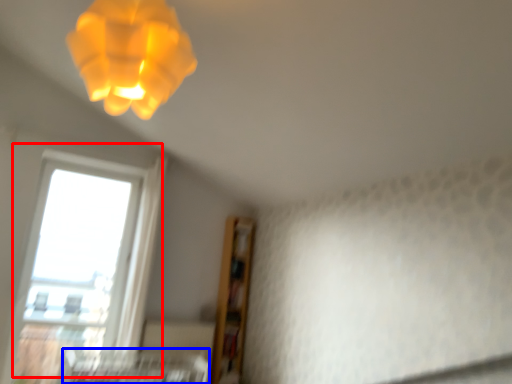
Question: Which object appears closest to the camera in this image, window (highlighted by a red box) or bed frame (highlighted by a blue box)?

Choices:
 (A) window
 (B) bed frame

Answer: (B)